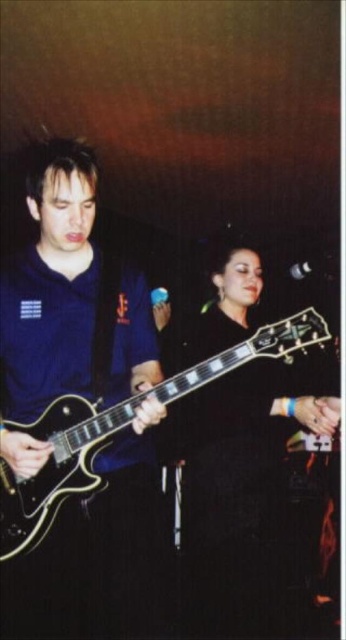
Who is positioned more to the left, shiny black guitar at center or black glossy electric guitar at center?

black glossy electric guitar at center is more to the left.

Which of these two, shiny black guitar at center or black glossy electric guitar at center, stands shorter?

black glossy electric guitar at center is shorter.

Locate an element on the screen. Image resolution: width=346 pixels, height=640 pixels. shiny black guitar at center is located at coordinates (237, 492).

This screenshot has width=346, height=640. I want to click on shiny black guitar at center, so click(x=237, y=492).

What do you see at coordinates (70, 298) in the screenshot?
I see `matte black guitar at left` at bounding box center [70, 298].

Is matte black guitar at left taller than shiny black guitar at center?

Incorrect, matte black guitar at left's height is not larger of shiny black guitar at center's.

Who is more distant from viewer, (x=131, y=500) or (x=232, y=612)?

The point (x=232, y=612) is more distant.

The width and height of the screenshot is (346, 640). I want to click on matte black guitar at left, so click(x=70, y=298).

Which is more to the right, matte black guitar at left or black glossy electric guitar at center?

black glossy electric guitar at center

Between matte black guitar at left and black glossy electric guitar at center, which one has more height?

With more height is matte black guitar at left.

Is point (104, 573) behind point (22, 426)?

Yes, it is behind point (22, 426).

Where is `matte black guitar at left`? Image resolution: width=346 pixels, height=640 pixels. matte black guitar at left is located at coordinates (70, 298).